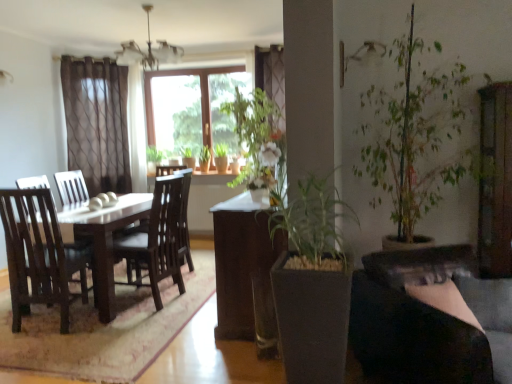
Question: Which direction should I rotate to face green leafy plant at center, arranged as the second houseplant when ordered from the bottom, — up or down?

Choices:
 (A) down
 (B) up

Answer: (B)

Question: Is brown wooden table at center completely or partially inside green matte plant at center, acting as the 2th houseplant starting from the top?

Choices:
 (A) yes
 (B) no

Answer: (B)

Question: Considering the relative sizes of green matte plant at center, acting as the 2th houseplant starting from the top, and brown wooden table at center in the image provided, is green matte plant at center, acting as the 2th houseplant starting from the top, shorter than brown wooden table at center?

Choices:
 (A) no
 (B) yes

Answer: (A)

Question: Can you confirm if green matte plant at center, acting as the 2th houseplant starting from the top, is positioned to the right of brown wooden table at center?

Choices:
 (A) no
 (B) yes

Answer: (B)

Question: From the image's perspective, is green matte plant at center, placed as the first houseplant when sorted from bottom to top, above brown wooden table at center?

Choices:
 (A) yes
 (B) no

Answer: (B)

Question: Considering the relative positions of green matte plant at center, the second houseplant when ordered from back to front, and brown wooden table at center in the image provided, is green matte plant at center, the second houseplant when ordered from back to front, to the left of brown wooden table at center from the viewer's perspective?

Choices:
 (A) yes
 (B) no

Answer: (B)

Question: Is green matte plant at center, acting as the 2th houseplant starting from the top, wider than brown wooden table at center?

Choices:
 (A) yes
 (B) no

Answer: (B)

Question: Is the position of green matte plant at center, acting as the 2th houseplant starting from the top, more distant than that of green leafy plant at center, placed as the 1th houseplant when sorted from left to right?

Choices:
 (A) yes
 (B) no

Answer: (B)

Question: Does green matte plant at center, acting as the 2th houseplant starting from the top, turn towards green leafy plant at center, positioned as the 1th houseplant in back-to-front order?

Choices:
 (A) yes
 (B) no

Answer: (B)

Question: Is green matte plant at center, the first houseplant viewed from the right, looking in the opposite direction of green leafy plant at center, arranged as the second houseplant when ordered from the bottom?

Choices:
 (A) yes
 (B) no

Answer: (B)

Question: Does green matte plant at center, the first houseplant viewed from the right, have a greater width compared to green leafy plant at center, positioned as the 1th houseplant in back-to-front order?

Choices:
 (A) yes
 (B) no

Answer: (A)

Question: Is green matte plant at center, placed as the first houseplant when sorted from bottom to top, in front of green leafy plant at center, positioned as the 1th houseplant in back-to-front order?

Choices:
 (A) yes
 (B) no

Answer: (A)

Question: From the image's perspective, is green matte plant at center, the second houseplant when ordered from back to front, below green leafy plant at center, positioned as the 1th houseplant in back-to-front order?

Choices:
 (A) no
 (B) yes

Answer: (B)

Question: Can you confirm if brown wooden table at center is positioned to the left of green leafy plant at center, acting as the 2th houseplant starting from the front?

Choices:
 (A) no
 (B) yes

Answer: (A)